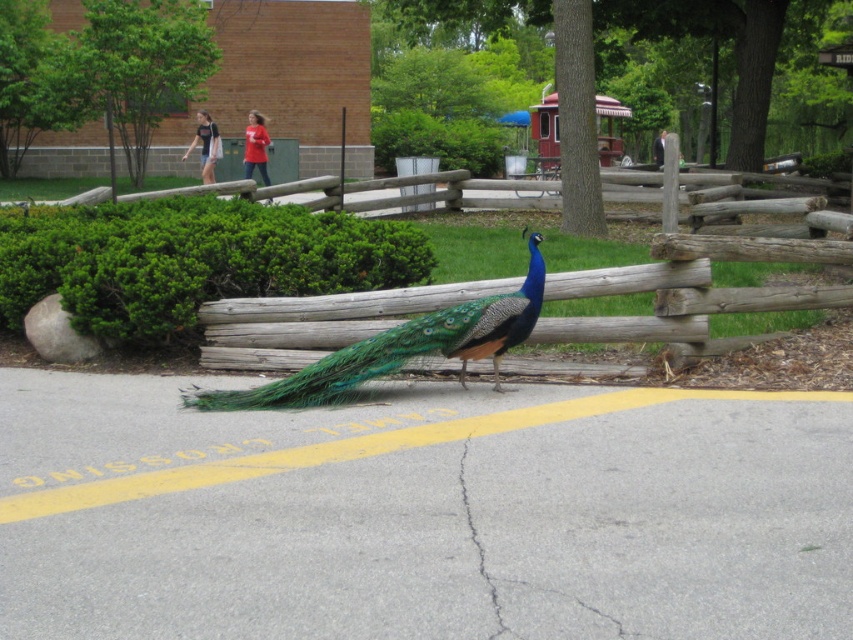
Question: Can you confirm if shiny blue peacock at center is wider than gray concrete crack at center?

Choices:
 (A) no
 (B) yes

Answer: (B)

Question: Is shiny blue peacock at center above gray concrete crack at center?

Choices:
 (A) no
 (B) yes

Answer: (B)

Question: Which point is farther to the camera?

Choices:
 (A) gray concrete crack at center
 (B) shiny blue peacock at center
 (C) wooden fence at center

Answer: (C)

Question: Among these points, which one is nearest to the camera?

Choices:
 (A) (467, 490)
 (B) (344, 326)
 (C) (476, 333)

Answer: (A)

Question: Considering the real-world distances, which object is closest to the wooden fence at center?

Choices:
 (A) gray concrete crack at center
 (B) shiny blue peacock at center

Answer: (B)

Question: Can you confirm if wooden fence at center is positioned above shiny blue peacock at center?

Choices:
 (A) yes
 (B) no

Answer: (A)